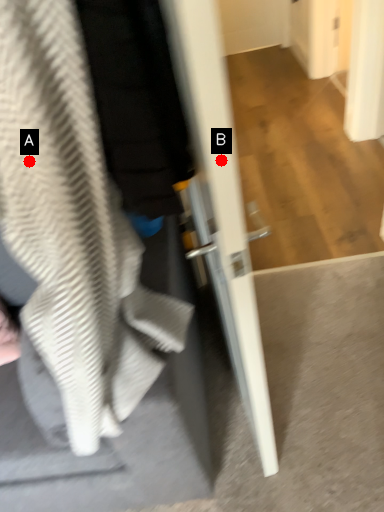
Question: Two points are circled on the image, labeled by A and B beside each circle. Which of the following is the farthest from the observer?

Choices:
 (A) A is further
 (B) B is further

Answer: (A)